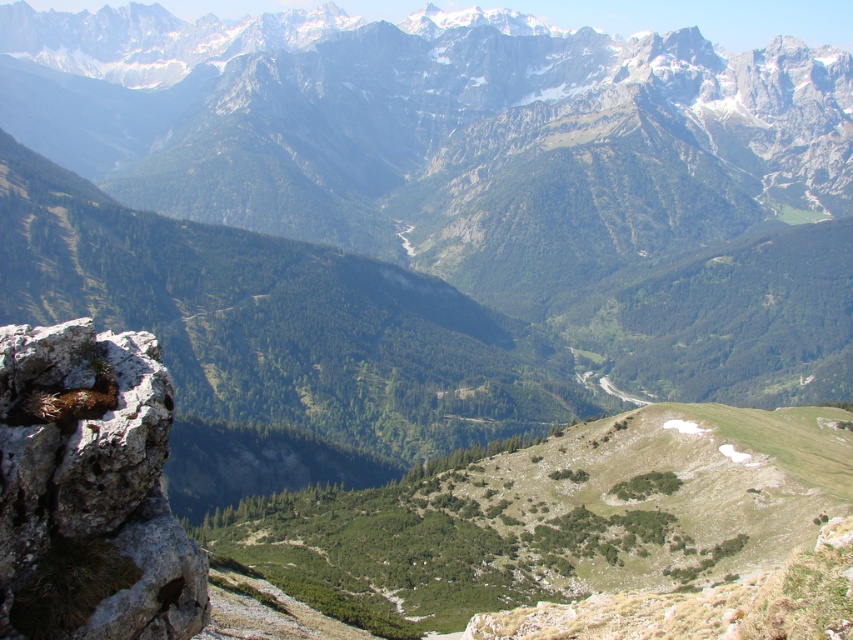
Based on the photo, you are standing at the base of the gray rough rock at lower left and want to climb to the top of the green grassy hillside at center. Which path would require more effort due to elevation difference?

The path to the top of the green grassy hillside at center would require more effort because it has a greater height compared to the gray rough rock at lower left.

You are standing at the edge of the gray rough rock at lower left and want to walk towards the green grassy hillside at center. Which direction should you move relative to the rock?

Since the gray rough rock at lower left is behind the green grassy hillside at center, you should move forward towards the green grassy hillside at center to reach it.